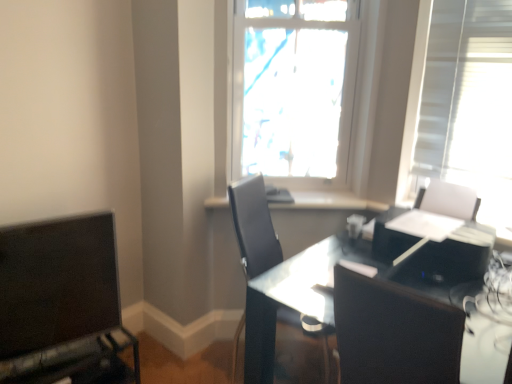
Where is `free spot above white glossy window sill at center (from a real-world perspective)`? This screenshot has height=384, width=512. free spot above white glossy window sill at center (from a real-world perspective) is located at coordinates (304, 194).